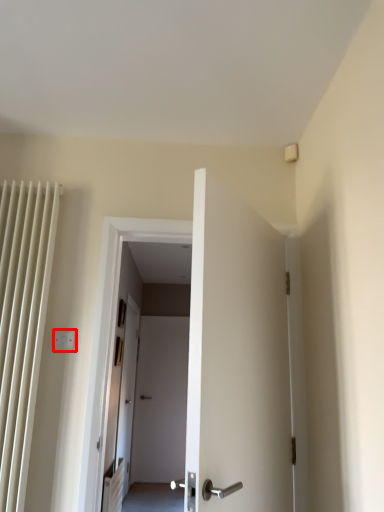
Question: From the image's perspective, what is the correct spatial relationship of electric outlet (annotated by the red box) in relation to path?

Choices:
 (A) above
 (B) below

Answer: (A)